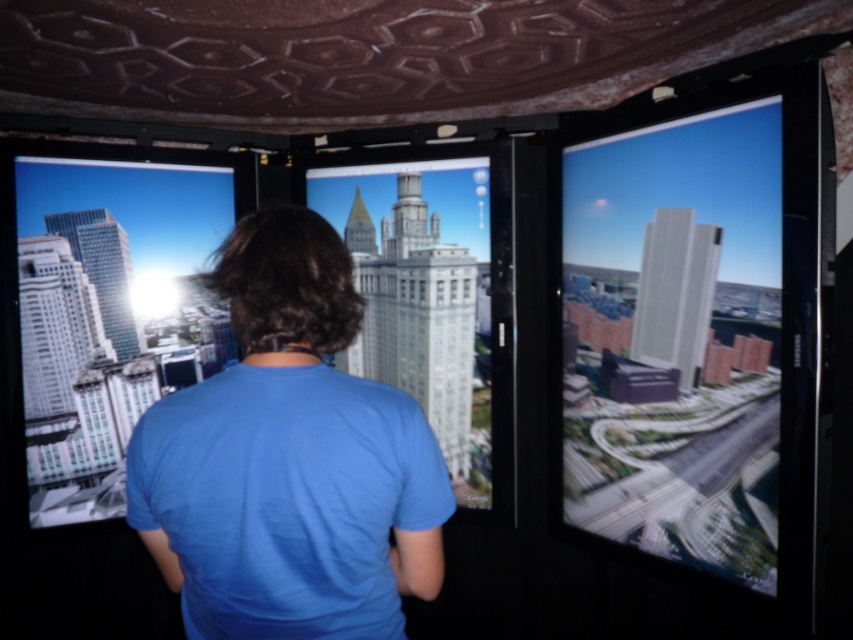
Question: Considering the real-world distances, which object is closest to the white glossy building at left?

Choices:
 (A) smooth glass skyscraper at right
 (B) blue cotton shirt at center

Answer: (B)

Question: Does blue cotton shirt at center have a smaller size compared to white glossy building at left?

Choices:
 (A) no
 (B) yes

Answer: (B)

Question: Is blue cotton shirt at center behind white glossy building at left?

Choices:
 (A) no
 (B) yes

Answer: (A)

Question: Can you confirm if smooth glass skyscraper at right is bigger than blue cotton shirt at center?

Choices:
 (A) yes
 (B) no

Answer: (A)

Question: Based on their relative distances, which object is nearer to the white glossy building at left?

Choices:
 (A) smooth glass skyscraper at right
 (B) blue cotton shirt at center

Answer: (B)

Question: Which object appears farthest from the camera in this image?

Choices:
 (A) blue cotton shirt at center
 (B) smooth glass skyscraper at right
 (C) white glossy building at left

Answer: (C)